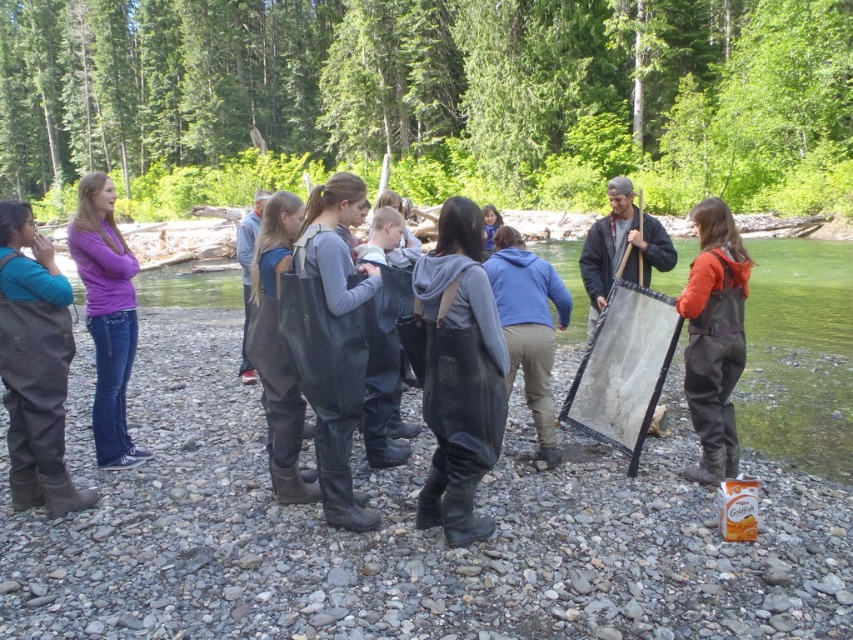
You are a hiker who needs to cross the river. You see the brown leather boots at left and the orange waterproof overalls at center. Which item would you choose to wear for your feet to ensure they stay dry?

The brown leather boots at left is much taller than the orange waterproof overalls at center, so you should choose the brown leather boots at left to keep your feet dry.

You are standing at the riverbank and want to place a small marker between the two points. Which point should you place it closer to if you want it to be closer to the water? The two points are point 1 at coordinates (740, 312) and point 2 at coordinates (544, 332). The water is at the lowest elevation in this area.

Point 1 at coordinates (740, 312) is in front of point 2 at coordinates (544, 332). Since the water is at the lowest elevation, placing the marker closer to point 1 would be nearer to the water.